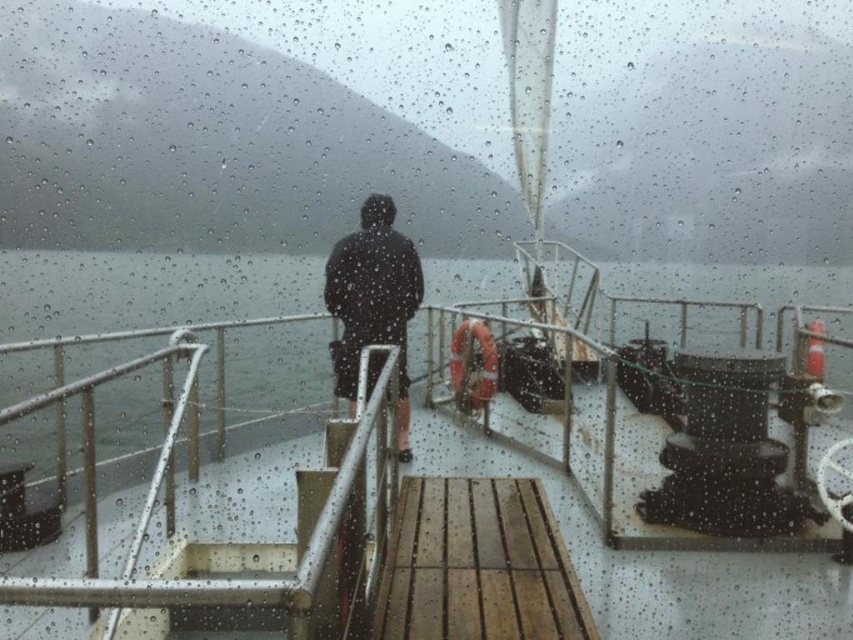
You are a photographer trying to capture the entire scene through the rain streaked window. You notice the wooden at center and the dark matte jacket at center. Which object takes up more area in the photo?

The dark matte jacket at center takes up more area than the wooden at center in the photo.

You are on a boat deck during a rainstorm and need to determine which object is shorter between the wooden at center and the dark matte jacket at center. Which one is shorter?

The wooden at center is shorter than the dark matte jacket at center.

You are a photographer trying to capture the entire wooden at center and dark matte jacket at center in one frame. Based on their sizes, which object should you focus on to ensure both fit in the photo?

The wooden at center is wider than the dark matte jacket at center, so you should focus on the wooden at center to ensure both fit in the photo.